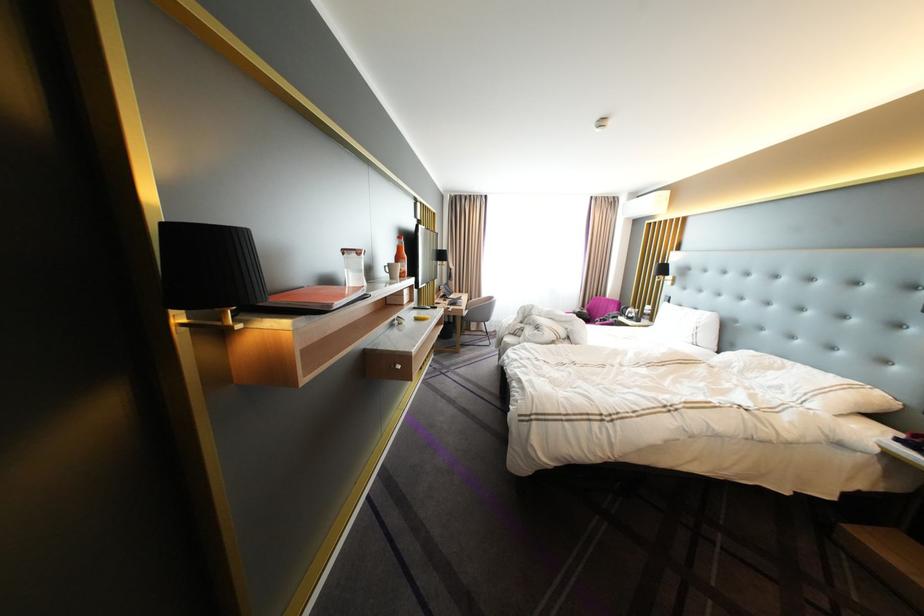
Find the location of `red notebook`. red notebook is located at coordinates (313, 297).